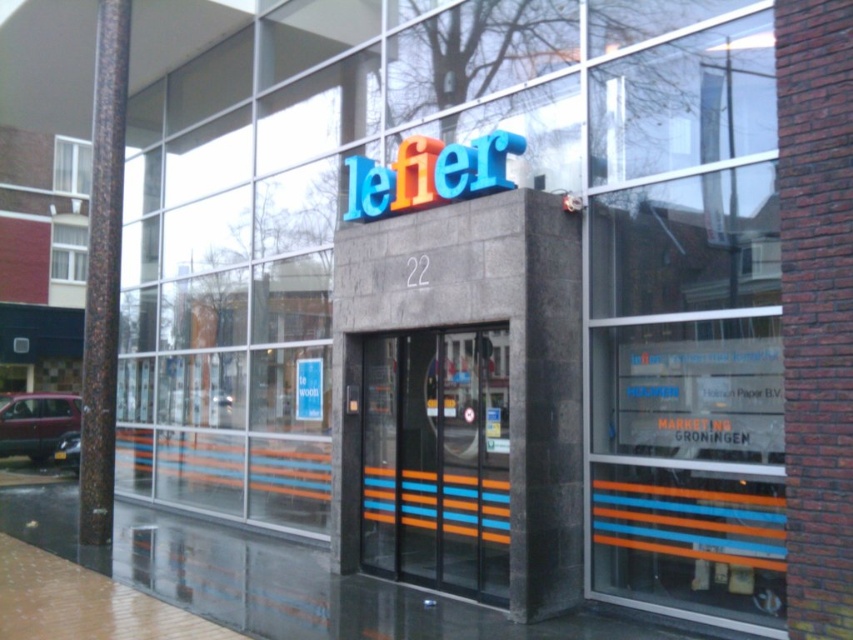
You are a delivery person trying to find the entrance to the building. You see the orange striped glass door at center and the white plastic window at upper left. Which one is taller?

The orange striped glass door at center is much taller than the white plastic window at upper left, so the orange striped glass door at center is taller.